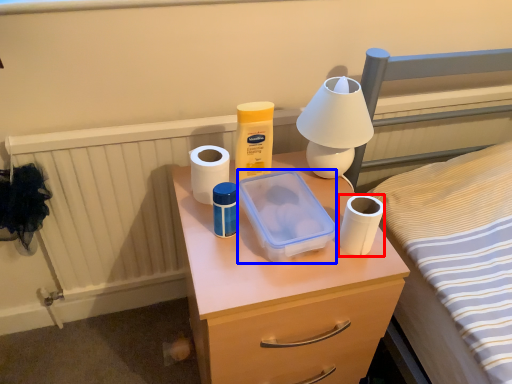
Question: Which object appears closest to the camera in this image, toilet paper (highlighted by a red box) or storage box (highlighted by a blue box)?

Choices:
 (A) toilet paper
 (B) storage box

Answer: (B)